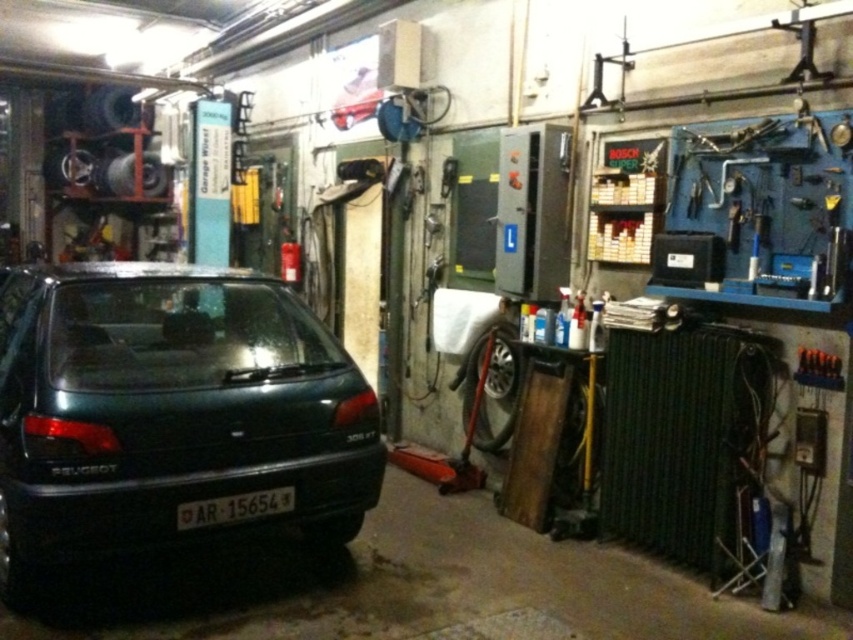
Question: Is white plastic license plate at center wider than metallic orange tool at right?

Choices:
 (A) yes
 (B) no

Answer: (A)

Question: Is green matte car at left above metallic orange tool at right?

Choices:
 (A) no
 (B) yes

Answer: (A)

Question: Which of the following is the farthest from the observer?

Choices:
 (A) (218, 504)
 (B) (831, 374)
 (C) (317, 490)

Answer: (B)

Question: Which of these objects is positioned farthest from the white plastic license plate at center?

Choices:
 (A) metallic orange tool at right
 (B) green matte car at left

Answer: (A)

Question: Is white plastic license plate at center to the right of metallic orange tool at right from the viewer's perspective?

Choices:
 (A) yes
 (B) no

Answer: (B)

Question: Which object is closer to the camera taking this photo?

Choices:
 (A) white plastic license plate at center
 (B) metallic orange tool at right

Answer: (A)